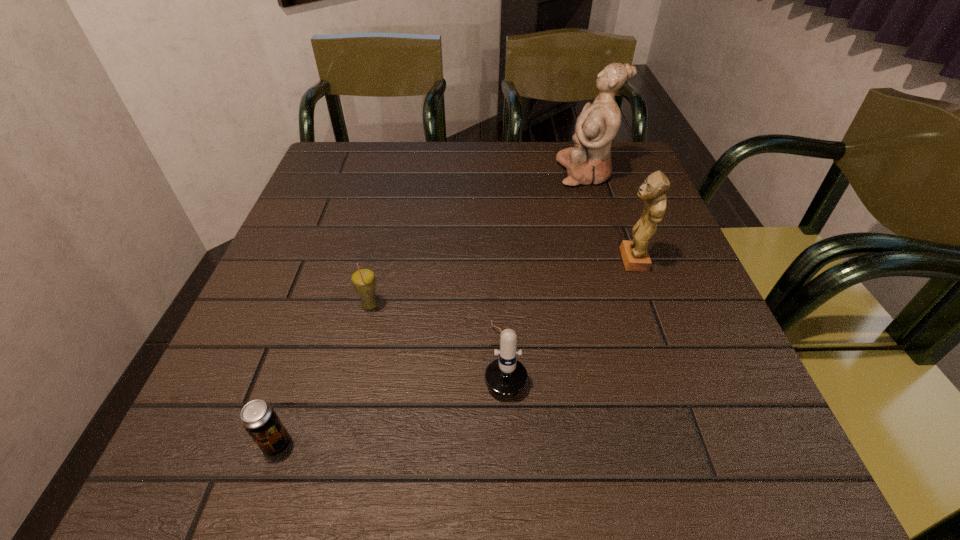
Where is `vacant point located between the fourth object from right to left and the nearest object`? The width and height of the screenshot is (960, 540). vacant point located between the fourth object from right to left and the nearest object is located at coordinates (324, 375).

This screenshot has height=540, width=960. Identify the location of vacant space that is in between the fourth nearest object and the third object from left to right. (568, 309).

The image size is (960, 540). In order to click on free area in between the nearest object and the second nearest object in this screenshot , I will do `click(391, 401)`.

In order to click on vacant region between the third object from right to left and the beer can in this screenshot , I will do `click(391, 401)`.

I want to click on vacant region between the third nearest object and the second farthest object, so click(501, 283).

Locate an element on the screen. unoccupied position between the farthest object and the second nearest object is located at coordinates (545, 266).

Where is `vacant space that's between the microphone and the fourth nearest object`? vacant space that's between the microphone and the fourth nearest object is located at coordinates (568, 309).

Where is `free spot between the farthest object and the leftmost object`? This screenshot has height=540, width=960. free spot between the farthest object and the leftmost object is located at coordinates (431, 308).

Locate an element on the screen. unoccupied area between the leftmost object and the second object from left to right is located at coordinates (324, 375).

Find the location of `unoccupied position between the second tallest object and the second nearest object`. unoccupied position between the second tallest object and the second nearest object is located at coordinates (568, 309).